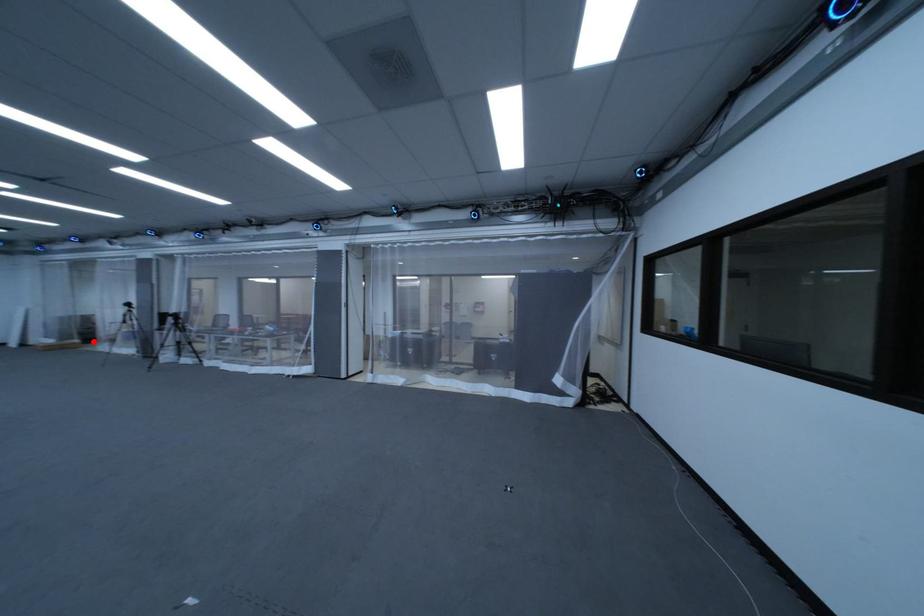
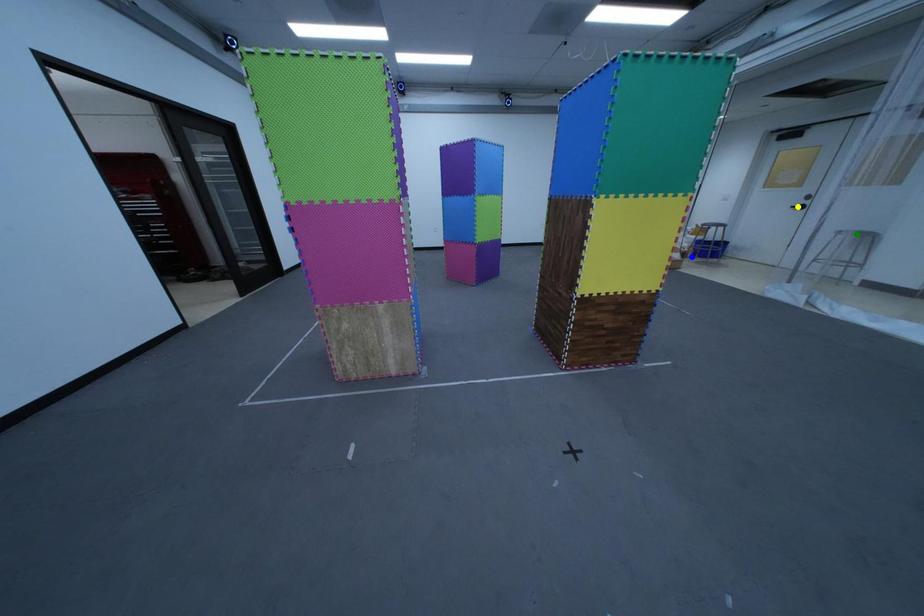
Question: I am providing you with two images of the same scene from different viewpoints. A red point is marked on the first image. You are given multiple points on the second image. Can you choose the point in image 2 that corresponds to the point in image 1?

Choices:
 (A) green point
 (B) yellow point
 (C) blue point

Answer: (C)